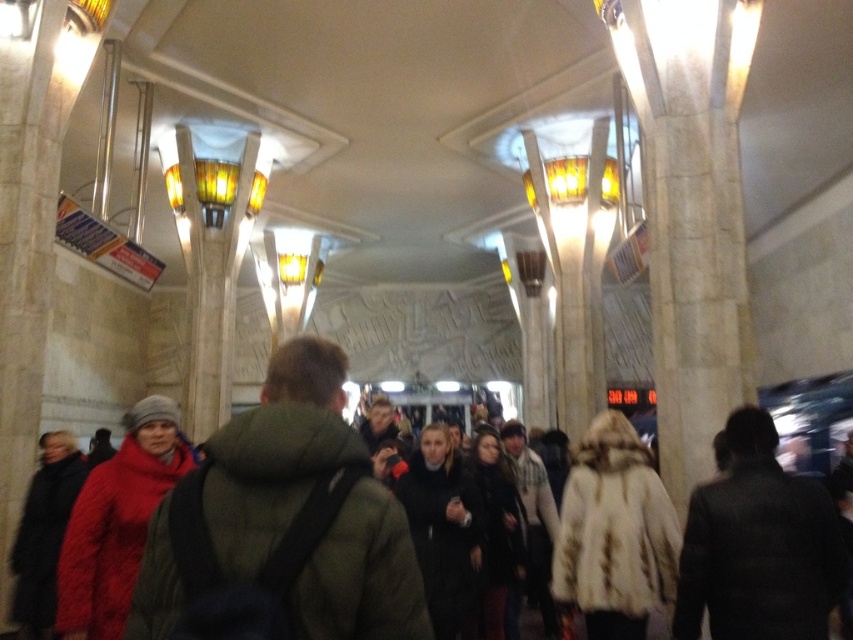
You are a security guard in the subway station and need to determine which coat is shorter between the dark gray coat at center and the fur coat at center. Which one is shorter?

The dark gray coat at center is shorter than the fur coat at center.

You are a person trying to decide which coat to wear for a walk. You have a matte green jacket at center and a dark gray coat at center. Which one is wider?

The matte green jacket at center is wider than the dark gray coat at center.